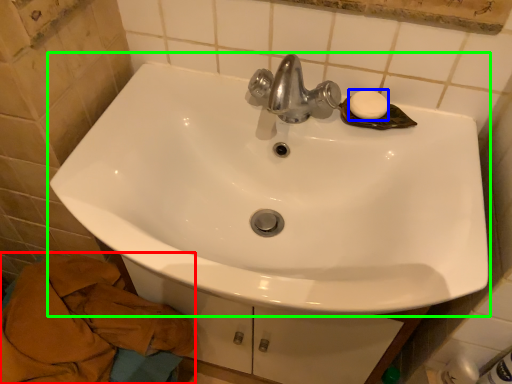
Question: Which is nearer to the bath towel (highlighted by a red box)? soap (highlighted by a blue box) or sink (highlighted by a green box).

Choices:
 (A) soap
 (B) sink

Answer: (B)